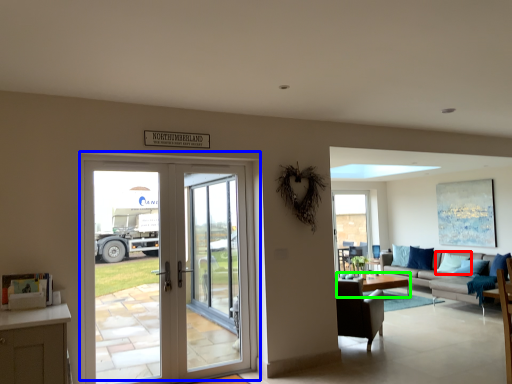
Question: Estimate the real-world distances between objects in this image. Which object is farther from pillow (highlighted by a red box), door (highlighted by a blue box) or coffee table (highlighted by a green box)?

Choices:
 (A) door
 (B) coffee table

Answer: (A)